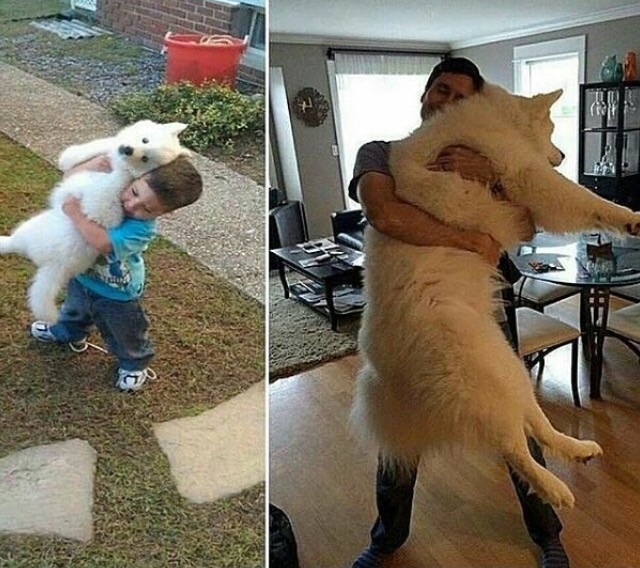
Locate an element on the screen. The width and height of the screenshot is (640, 568). red bucket is located at coordinates (196, 65).